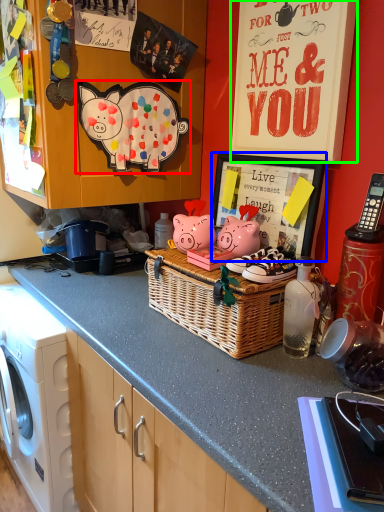
Question: Which object is the farthest from pig (highlighted by a red box)? Choose among these: picture frame (highlighted by a blue box) or bulletin board (highlighted by a green box).

Choices:
 (A) picture frame
 (B) bulletin board

Answer: (B)